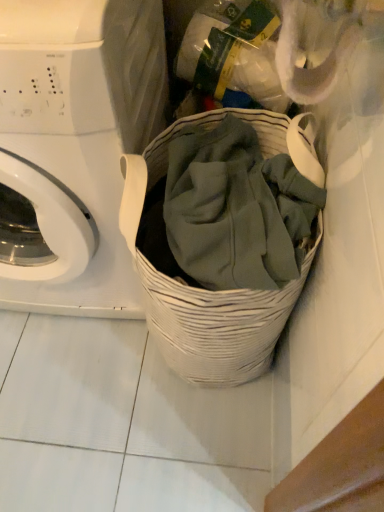
What do you see at coordinates (76, 144) in the screenshot? I see `white glossy washing machine at left` at bounding box center [76, 144].

At what (x,y) coordinates should I click in order to perform the action: click on white glossy washing machine at left. Please return your answer as a coordinate pair (x, y). This screenshot has width=384, height=512. Looking at the image, I should click on (76, 144).

Measure the distance between point (86, 272) and camera.

A distance of 38.31 inches exists between point (86, 272) and camera.

Describe the element at coordinates (218, 324) in the screenshot. The height and width of the screenshot is (512, 384). I see `white woven basket at center` at that location.

Find the location of a particular element. white woven basket at center is located at coordinates (218, 324).

Where is `white glossy washing machine at left`? The height and width of the screenshot is (512, 384). white glossy washing machine at left is located at coordinates (76, 144).

Does white woven basket at center appear on the right side of white glossy washing machine at left?

Yes.

In the image, is white woven basket at center positioned in front of or behind white glossy washing machine at left?

Visually, white woven basket at center is located behind white glossy washing machine at left.

Which is closer to the camera, (x=177, y=346) or (x=96, y=273)?

Clearly, point (x=177, y=346) is closer to the camera than point (x=96, y=273).

From the image's perspective, would you say white woven basket at center is positioned over white glossy washing machine at left?

Incorrect, from the image's perspective, white woven basket at center is lower than white glossy washing machine at left.

From a real-world perspective, which is physically above, white woven basket at center or white glossy washing machine at left?

From a 3D spatial view, white glossy washing machine at left is above.

Is white woven basket at center thinner than white glossy washing machine at left?

Indeed, white woven basket at center has a lesser width compared to white glossy washing machine at left.

In terms of height, does white woven basket at center look taller or shorter compared to white glossy washing machine at left?

Considering their sizes, white woven basket at center has less height than white glossy washing machine at left.

Consider the image. Considering the sizes of objects white woven basket at center and white glossy washing machine at left in the image provided, who is smaller, white woven basket at center or white glossy washing machine at left?

Smaller between the two is white woven basket at center.

Is white woven basket at center located outside white glossy washing machine at left?

Indeed, white woven basket at center is completely outside white glossy washing machine at left.

Are white woven basket at center and white glossy washing machine at left far apart?

No, white woven basket at center is not far away from white glossy washing machine at left.

Is white woven basket at center looking in the opposite direction of white glossy washing machine at left?

No.

Can you tell me how much white woven basket at center and white glossy washing machine at left differ in facing direction?

The facing directions of white woven basket at center and white glossy washing machine at left are 0.0322 degrees apart.

Find the location of a particular element. basket lying below the white glossy washing machine at left (from the image's perspective) is located at coordinates (218, 324).

Considering the relative positions of white glossy washing machine at left and white woven basket at center in the image provided, is white glossy washing machine at left to the right of white woven basket at center from the viewer's perspective?

No.

Relative to white woven basket at center, is white glossy washing machine at left in front or behind?

In the image, white glossy washing machine at left appears in front of white woven basket at center.

Is point (152, 132) positioned before point (209, 361)?

No, (152, 132) is further to viewer.

From the image's perspective, is white glossy washing machine at left below white woven basket at center?

No, from the image's perspective, white glossy washing machine at left is not beneath white woven basket at center.

From a real-world perspective, who is located lower, white glossy washing machine at left or white woven basket at center?

In real-world perspective, white woven basket at center is lower.

Considering the sizes of white glossy washing machine at left and white woven basket at center in the image, is white glossy washing machine at left wider or thinner than white woven basket at center?

white glossy washing machine at left is wider than white woven basket at center.

From their relative heights in the image, would you say white glossy washing machine at left is taller or shorter than white woven basket at center?

white glossy washing machine at left is taller than white woven basket at center.

Who is bigger, white glossy washing machine at left or white woven basket at center?

white glossy washing machine at left.

Is white glossy washing machine at left inside the boundaries of white woven basket at center, or outside?

white glossy washing machine at left lies outside white woven basket at center.

Is white glossy washing machine at left not close to white woven basket at center?

No.

In the scene shown: Does white glossy washing machine at left turn towards white woven basket at center?

No, white glossy washing machine at left does not turn towards white woven basket at center.

At what (x,y) coordinates should I click in order to perform the action: click on washing machine in front of the white woven basket at center. Please return your answer as a coordinate pair (x, y). Image resolution: width=384 pixels, height=512 pixels. Looking at the image, I should click on (76, 144).

Where is `washing machine lying in front of the white woven basket at center`? The width and height of the screenshot is (384, 512). washing machine lying in front of the white woven basket at center is located at coordinates (76, 144).

You are a GUI agent. You are given a task and a screenshot of the screen. Output one action in this format:
    pyautogui.click(x=<x>, y=<y>)
    Task: Click on the washing machine on the left of white woven basket at center
    
    Given the screenshot: What is the action you would take?
    pyautogui.click(x=76, y=144)